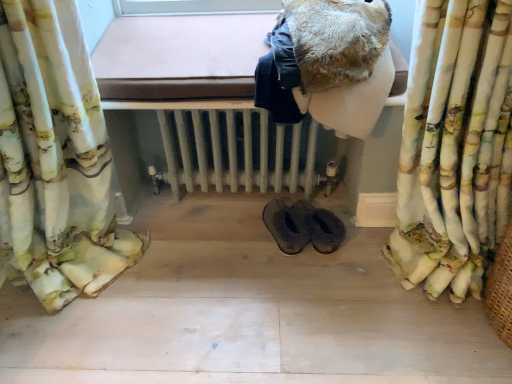
Where is `vacant space underneath white painted radiator at center (from a real-world perspective)`? vacant space underneath white painted radiator at center (from a real-world perspective) is located at coordinates (227, 203).